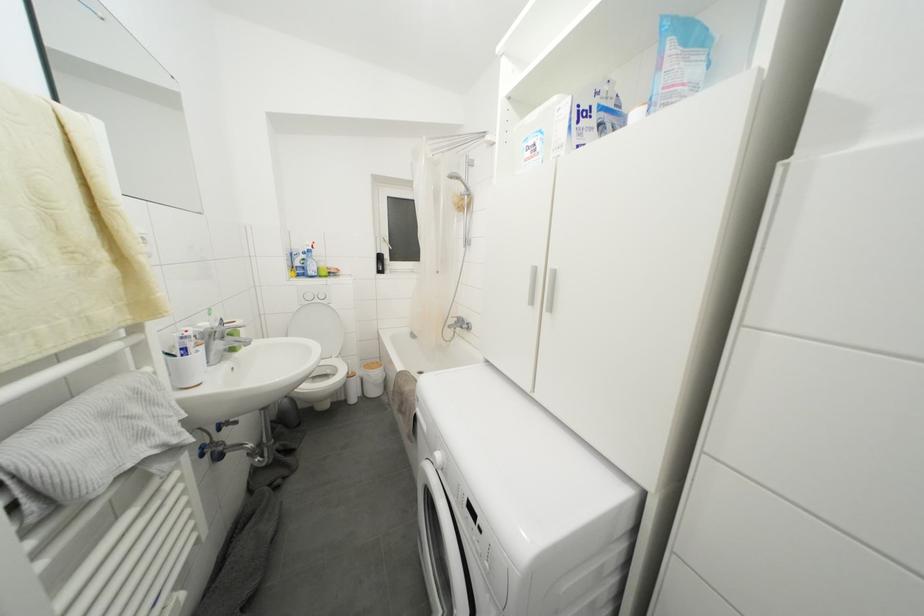
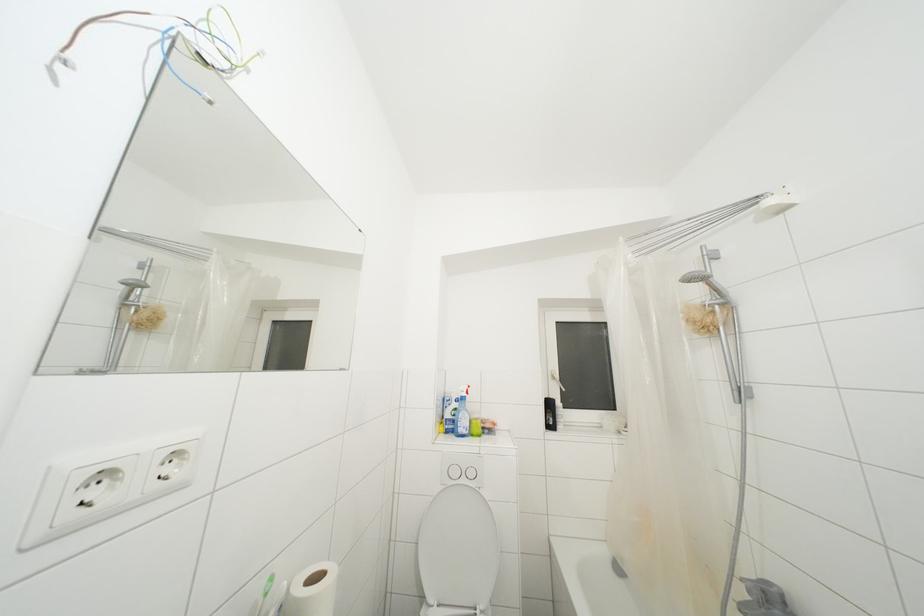
The images are taken continuously from a first-person perspective. In which direction is your viewpoint rotating?

The camera's rotation is toward left-up.